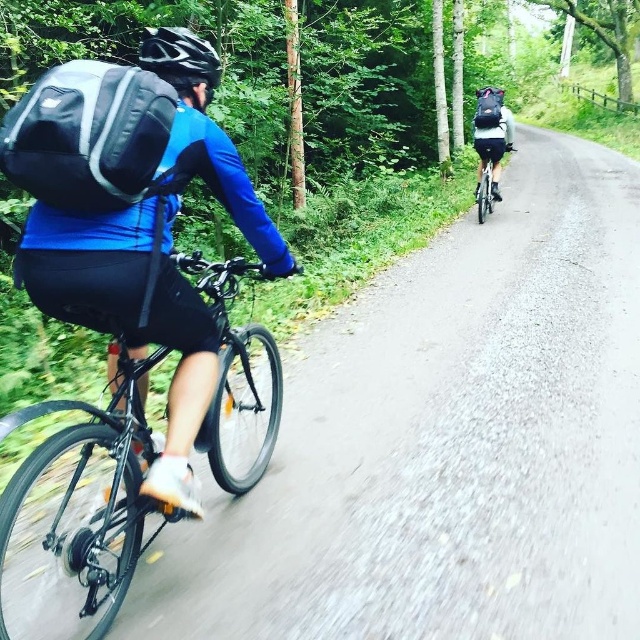
Locate an element on the screen. The image size is (640, 640). matte black backpack at left is located at coordinates (129, 225).

Which is behind, point (28, 216) or point (506, 150)?

Positioned behind is point (506, 150).

Is point (102, 116) farther from viewer compared to point (483, 180)?

No, (102, 116) is in front of (483, 180).

You are a GUI agent. You are given a task and a screenshot of the screen. Output one action in this format:
    pyautogui.click(x=<x>, y=<y>)
    Task: Click on the matte black backpack at left
    The height and width of the screenshot is (640, 640).
    Given the screenshot: What is the action you would take?
    click(129, 225)

Is black matte helmet at upper left below matte black backpack at upper right?

Correct, black matte helmet at upper left is located below matte black backpack at upper right.

How much distance is there between black matte helmet at upper left and matte black backpack at upper right?

black matte helmet at upper left is 6.47 meters from matte black backpack at upper right.

Locate an element on the screen. The width and height of the screenshot is (640, 640). black matte helmet at upper left is located at coordinates (179, 52).

Is the position of shiny black bicycle at left more distant than that of black matte helmet at upper left?

No, shiny black bicycle at left is closer to the viewer.

Can you confirm if shiny black bicycle at left is wider than black matte helmet at upper left?

Correct, the width of shiny black bicycle at left exceeds that of black matte helmet at upper left.

Locate an element on the screen. The width and height of the screenshot is (640, 640). shiny black bicycle at left is located at coordinates 76,486.